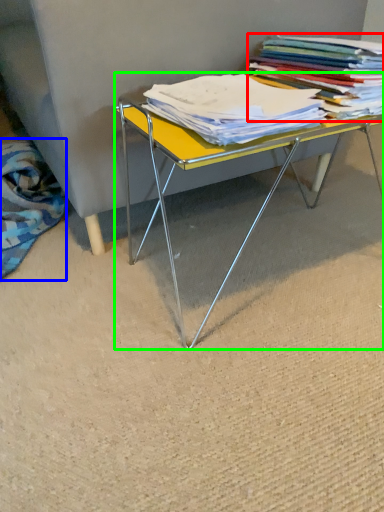
Question: Which object is positioned closest to book (highlighted by a red box)? Select from fabric (highlighted by a blue box) and table (highlighted by a green box).

Choices:
 (A) fabric
 (B) table

Answer: (B)